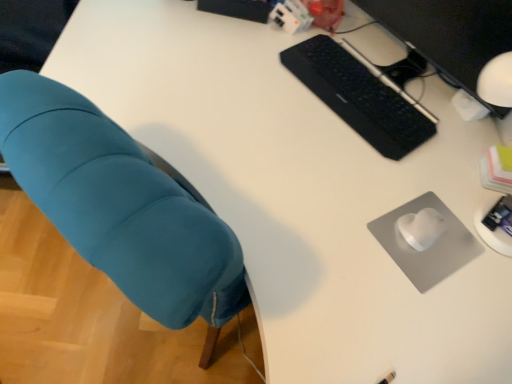
The image size is (512, 384). I want to click on free location above gray matte mousepad at lower right (from a real-world perspective), so click(x=435, y=245).